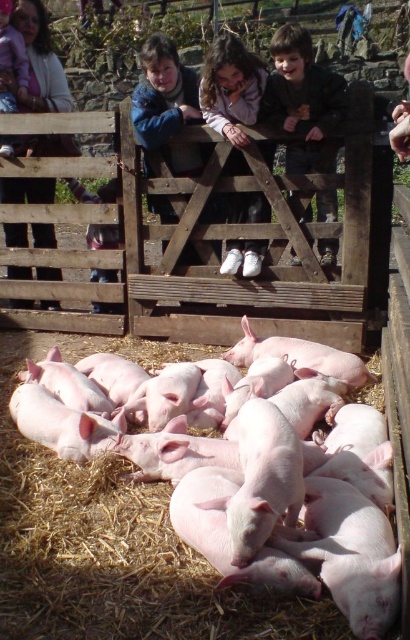
You are a farmer standing at the entrance of the farm and want to locate the matte pink piglets at lower center. According to the coordinates provided, where should you look to find them?

The matte pink piglets at lower center are located at point (41, 61), so you should look towards the lower center area of the image to find them.

You are standing at the point marked by the coordinate point at (114, 540) in the image. What do you see directly in front of you?

You see pink smooth piglets at lower center directly in front of you at the coordinate point at (114, 540).